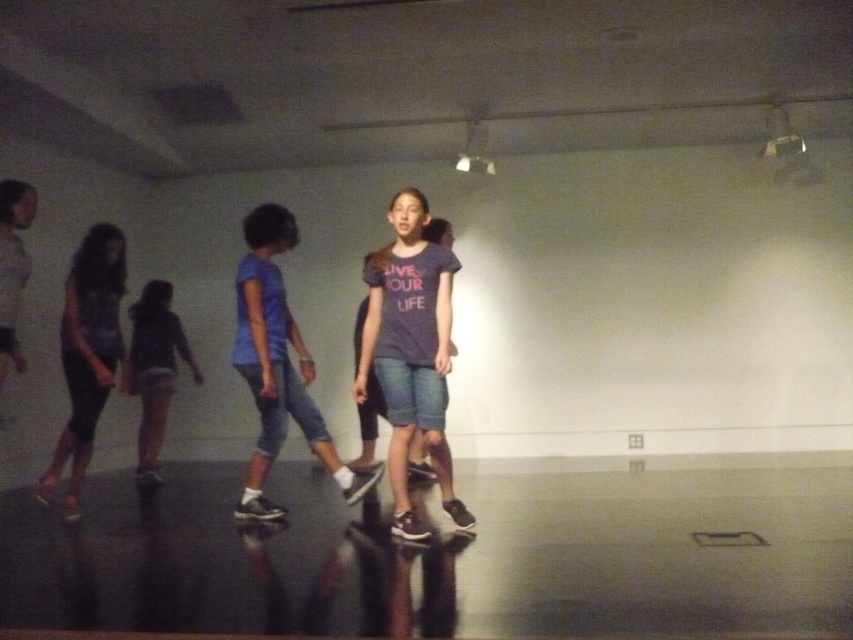
Does blue fabric shirt at center have a greater height compared to light purple fabric shorts at center?

Yes.

Does blue fabric shirt at center appear on the right side of light purple fabric shorts at center?

Indeed, blue fabric shirt at center is positioned on the right side of light purple fabric shorts at center.

Does point (283, 371) lie in front of point (161, 396)?

Yes, point (283, 371) is in front of point (161, 396).

This screenshot has width=853, height=640. In order to click on blue fabric shirt at center in this screenshot , I will do `click(277, 364)`.

From the picture: Which of these two, blue fabric shirt at center or matte black leggings at left, stands taller?

blue fabric shirt at center is taller.

Is blue fabric shirt at center closer to the viewer compared to matte black leggings at left?

Yes, it is.

At what (x,y) coordinates should I click in order to perform the action: click on blue fabric shirt at center. Please return your answer as a coordinate pair (x, y). The image size is (853, 640). Looking at the image, I should click on (277, 364).

What do you see at coordinates (86, 353) in the screenshot?
I see `matte black leggings at left` at bounding box center [86, 353].

Which is below, matte black leggings at left or light purple fabric shorts at center?

light purple fabric shorts at center is below.

The image size is (853, 640). What do you see at coordinates (86, 353) in the screenshot?
I see `matte black leggings at left` at bounding box center [86, 353].

What are the coordinates of `matte black leggings at left` in the screenshot? It's located at (86, 353).